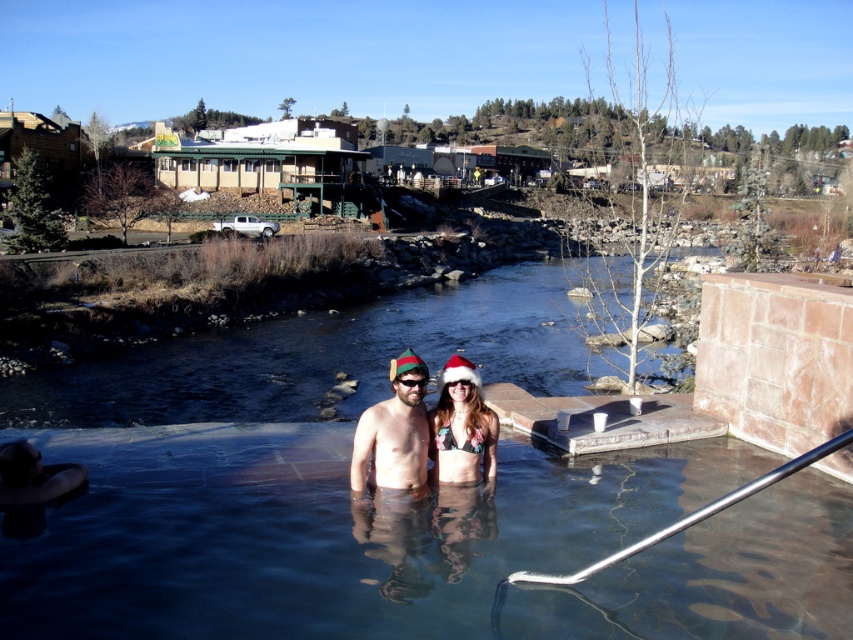
Looking at this image, between matte red bikini at center and matte black goggles at center, which one appears on the right side from the viewer's perspective?

Positioned to the right is matte red bikini at center.

Consider the image. Is matte red bikini at center above matte black goggles at center?

No.

Does point (469, 404) come in front of point (401, 381)?

No, (469, 404) is behind (401, 381).

Locate an element on the screen. Image resolution: width=853 pixels, height=640 pixels. matte red bikini at center is located at coordinates (462, 428).

Can you confirm if clear water at center is thinner than matte red bikini at center?

In fact, clear water at center might be wider than matte red bikini at center.

Between clear water at center and matte red bikini at center, which one appears on the left side from the viewer's perspective?

Positioned to the left is clear water at center.

Who is more distant from viewer, (180, 400) or (437, 380)?

Point (180, 400)

You are a GUI agent. You are given a task and a screenshot of the screen. Output one action in this format:
    pyautogui.click(x=<x>, y=<y>)
    Task: Click on the clear water at center
    The image size is (853, 640).
    Given the screenshot: What is the action you would take?
    pyautogui.click(x=332, y=355)

Who is higher up, clear water at center or shiny metallic hat at center?

Positioned higher is clear water at center.

Can you confirm if clear water at center is positioned above shiny metallic hat at center?

Correct, clear water at center is located above shiny metallic hat at center.

Between point (22, 410) and point (355, 477), which one is positioned in front?

Point (355, 477) is in front.

Find the location of a particular element. The image size is (853, 640). clear water at center is located at coordinates (332, 355).